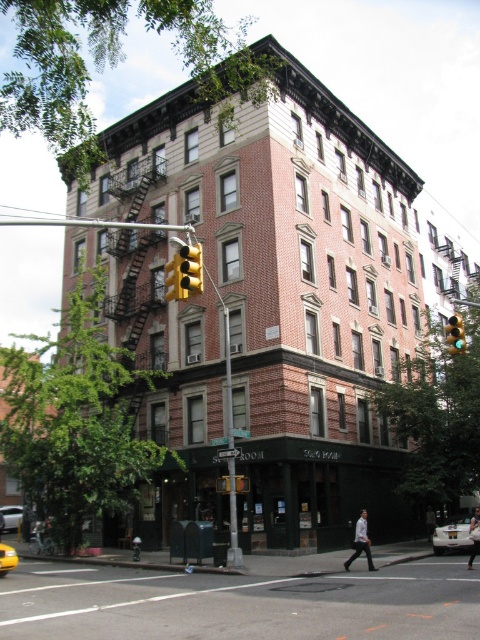
You are a delivery person standing at the entrance of the building. You need to deliver a package to the yellow plastic traffic light at upper center and the yellow plastic traffic light at center. Which one is closer to you?

The yellow plastic traffic light at center is closer to you because it is only 35.08 inches away from the yellow plastic traffic light at upper center, but since you are at the entrance, the one at center would be nearer.

You are a photographer standing in the street, wanting to capture both the white cotton shirt at lower center and the yellow rubber taxi at lower left in a single frame. Which object should you focus on first to ensure both are in the frame?

The white cotton shirt at lower center is bigger than the yellow rubber taxi at lower left, so you should focus on the white cotton shirt at lower center first to ensure both fit within the frame.

You are standing at the entrance of the building labeled SOHO ROOM. You see two points marked on the building facade. The first point is at coordinates point (359, 528) and the second point is at point (3, 563). From your vantage point at the entrance, which point is closer to you?

Point (3, 563) is closer to you because it is in front of point (359, 528) according to their spatial relationship.